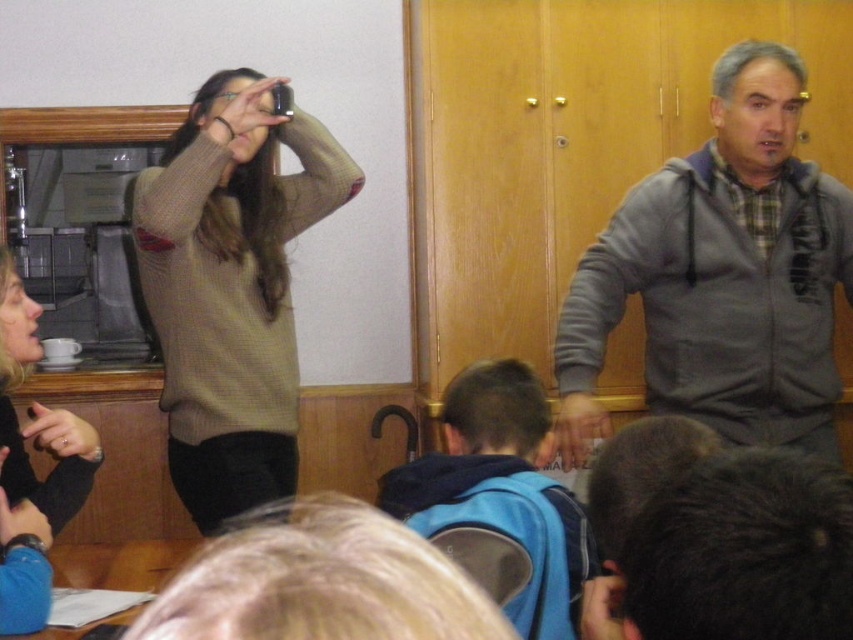
Question: Which point is farther from the camera taking this photo?

Choices:
 (A) (236, 129)
 (B) (526, 406)

Answer: (A)

Question: Which of the following is the farthest from the observer?

Choices:
 (A) dark brown fur at lower right
 (B) matte black camera at upper left
 (C) gray zip-up hoodie at right
 (D) knitted beige sweater at upper left

Answer: (D)

Question: Is knitted beige sweater at upper left to the left of gray zip-up hoodie at upper right from the viewer's perspective?

Choices:
 (A) no
 (B) yes

Answer: (B)

Question: From the image, what is the correct spatial relationship of knitted beige sweater at upper left in relation to dark brown fur at lower right?

Choices:
 (A) above
 (B) below

Answer: (A)

Question: Can you confirm if knitted beige sweater at upper left is wider than matte black hair at upper left?

Choices:
 (A) no
 (B) yes

Answer: (B)

Question: Which of the following is the closest to the observer?

Choices:
 (A) (33, 348)
 (B) (529, 449)
 (C) (202, 426)
 (D) (235, 77)

Answer: (B)